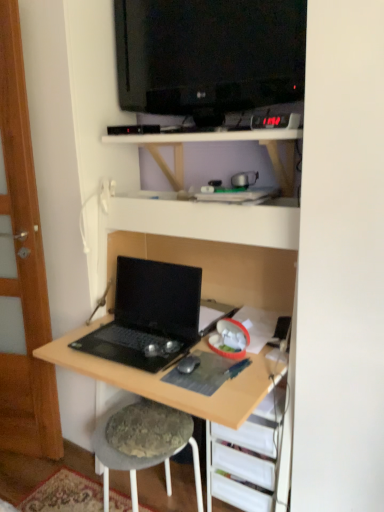
Question: Do you think textured gray stool at lower center is within transparent wood door at left, or outside of it?

Choices:
 (A) outside
 (B) inside

Answer: (A)

Question: Is textured gray stool at lower center in front of or behind transparent wood door at left in the image?

Choices:
 (A) front
 (B) behind

Answer: (A)

Question: Which object is the farthest from the black matte mouse at center?

Choices:
 (A) textured gray stool at lower center
 (B) black glossy television at upper center
 (C) white matte shelf at upper center, placed as the second shelf when sorted from bottom to top
 (D) wooden desk at lower right, the second shelf from the top
 (E) transparent wood door at left

Answer: (B)

Question: Which object is the closest to the black glossy television at upper center?

Choices:
 (A) textured gray stool at lower center
 (B) wooden desk at lower right, the second shelf from the top
 (C) black matte laptop at lower left
 (D) transparent wood door at left
 (E) white matte shelf at upper center, placed as the first shelf when sorted from top to bottom

Answer: (E)